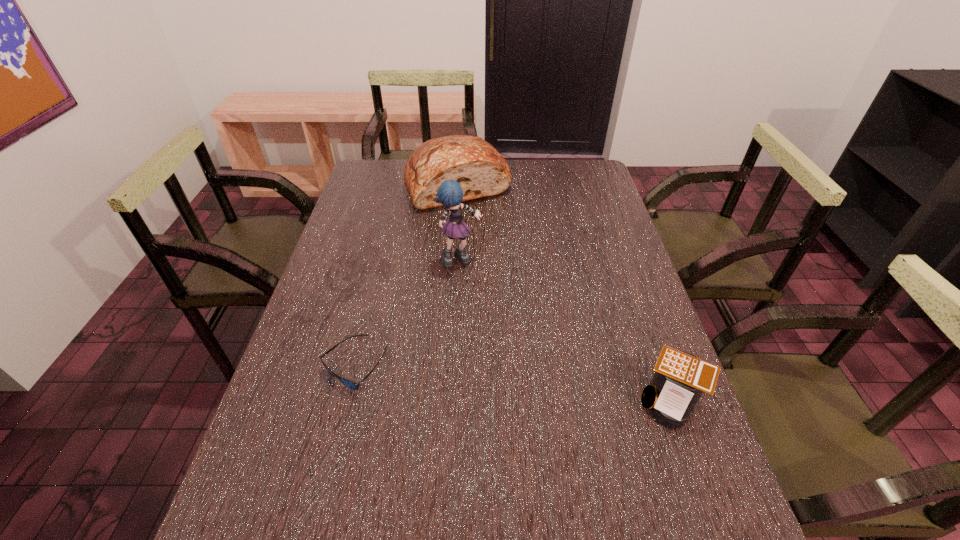
This screenshot has width=960, height=540. What are the coordinates of `vacant space located on the front-facing side of the third nearest object` in the screenshot? It's located at (494, 301).

The image size is (960, 540). In order to click on free location located on the front-facing side of the third nearest object in this screenshot , I will do `click(479, 281)`.

You are a GUI agent. You are given a task and a screenshot of the screen. Output one action in this format:
    pyautogui.click(x=<x>, y=<y>)
    Task: Click on the vacant space located 0.400m at the sliced front of the second tallest object
    The image size is (960, 540).
    Given the screenshot: What is the action you would take?
    pyautogui.click(x=504, y=293)

At what (x,y) coordinates should I click in order to perform the action: click on free point located 0.090m at the sliced front of the second tallest object. Please return your answer as a coordinate pair (x, y). The height and width of the screenshot is (540, 960). Looking at the image, I should click on (476, 228).

At what (x,y) coordinates should I click in order to perform the action: click on vacant space positioned 0.220m at the sliced front of the second tallest object. Please return your answer as a coordinate pair (x, y). Looking at the image, I should click on (487, 253).

Identify the location of object situated at the far edge. (476, 165).

Where is `object that is at the left edge`? The width and height of the screenshot is (960, 540). object that is at the left edge is located at coordinates (348, 383).

This screenshot has height=540, width=960. I want to click on object at the right edge, so click(x=680, y=378).

Find the location of a particular element. This screenshot has width=960, height=540. vacant region at the far edge of the desktop is located at coordinates (527, 187).

Locate an element on the screen. vacant space at the left edge of the desktop is located at coordinates (362, 240).